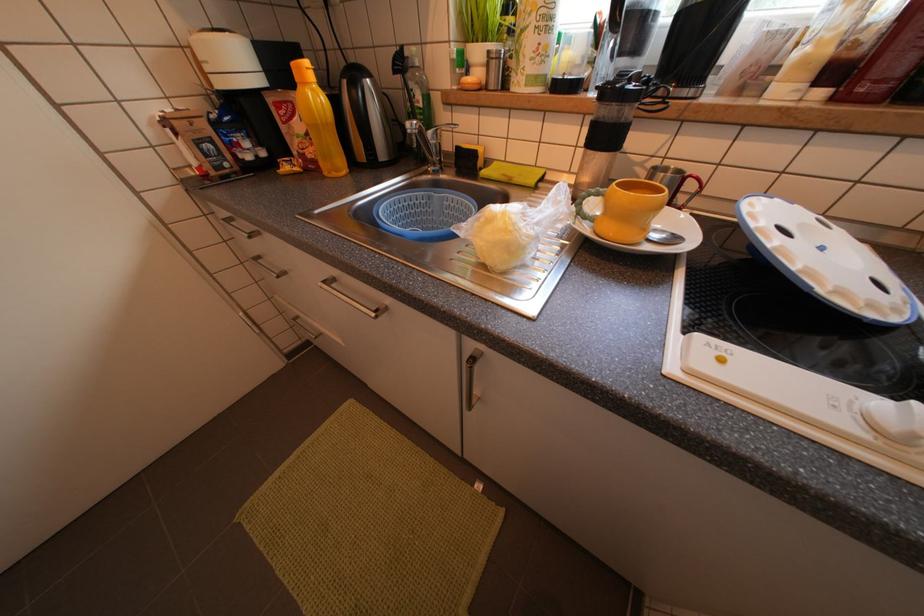
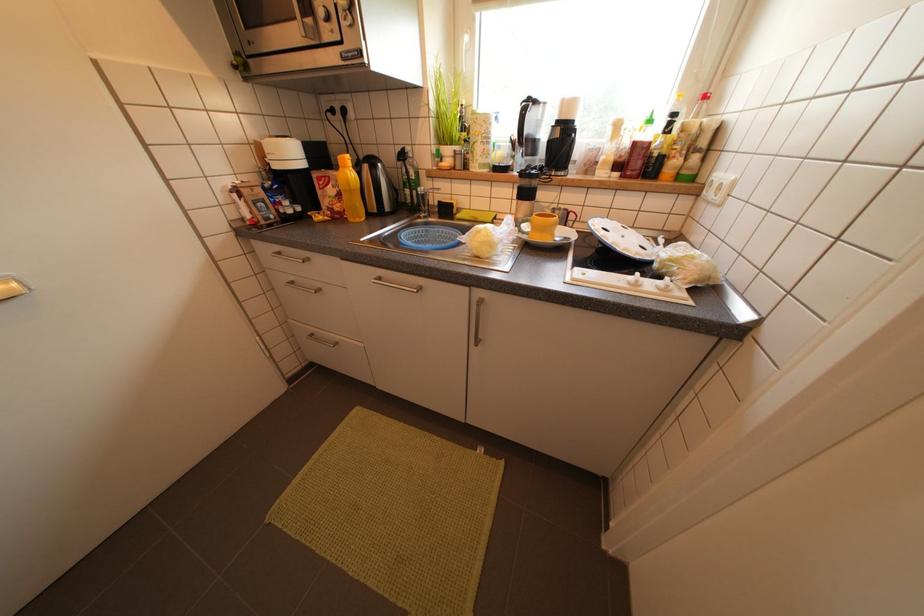
In a continuous first-person perspective shot, in which direction is the camera moving?

The cameraman walked toward left, backward.